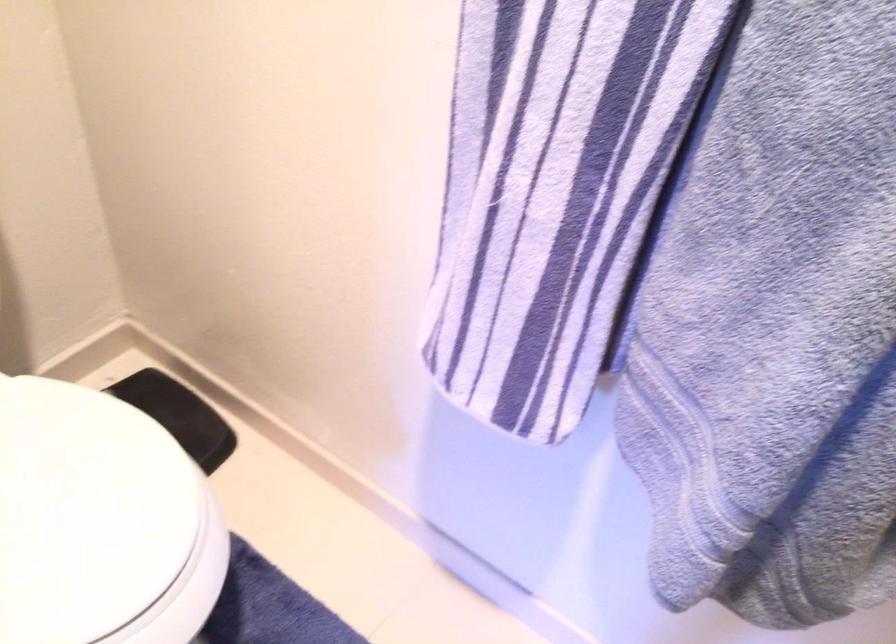
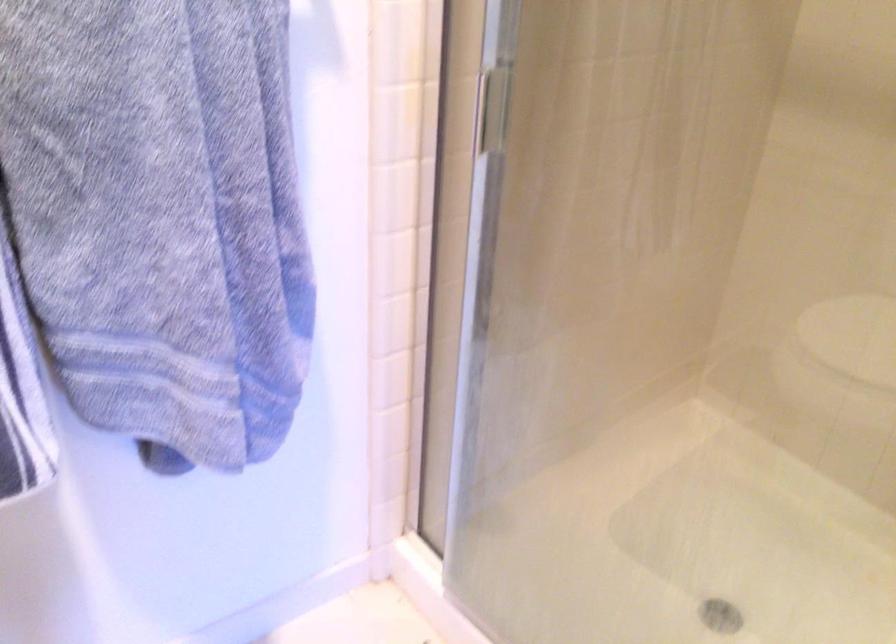
The images are taken continuously from a first-person perspective. In which direction is your viewpoint rotating?

The rotation direction of the camera is right-down.